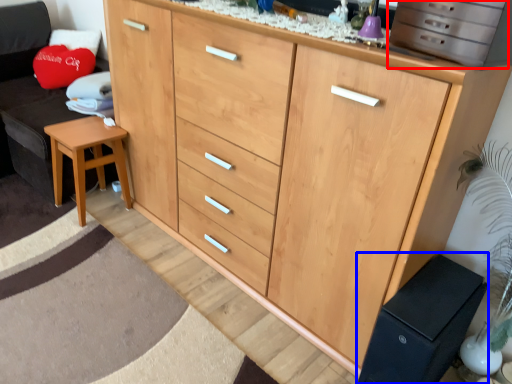
Question: Which object appears closest to the camera in this image, cabinetry (highlighted by a red box) or changing table (highlighted by a blue box)?

Choices:
 (A) cabinetry
 (B) changing table

Answer: (A)